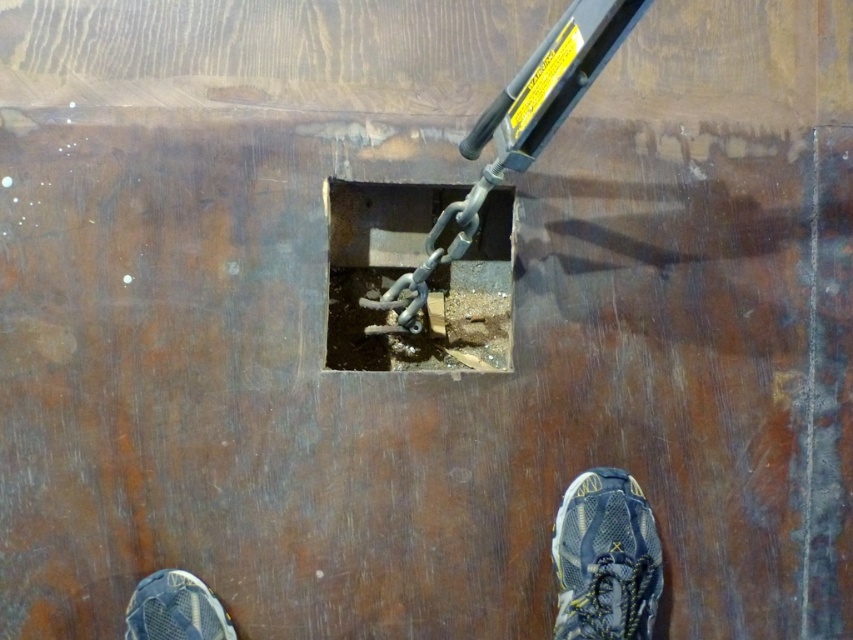
Question: Does blue mesh shoe at lower center appear under blue mesh shoe at lower left?

Choices:
 (A) yes
 (B) no

Answer: (B)

Question: Does blue mesh shoe at lower center have a smaller size compared to gray mesh shoe at lower right?

Choices:
 (A) yes
 (B) no

Answer: (A)

Question: Which object is the farthest from the gray mesh shoe at lower right?

Choices:
 (A) rusty metal hole at center
 (B) blue mesh shoe at lower left
 (C) blue mesh shoe at lower center

Answer: (B)

Question: Where is blue mesh shoe at lower center located in relation to blue mesh shoe at lower left in the image?

Choices:
 (A) left
 (B) right

Answer: (B)

Question: Which of the following is the closest to the observer?

Choices:
 (A) blue mesh shoe at lower left
 (B) blue mesh shoe at lower center
 (C) gray mesh shoe at lower right
 (D) rusty metal hole at center

Answer: (A)

Question: Which point is farther to the camera?

Choices:
 (A) blue mesh shoe at lower center
 (B) rusty metal hole at center
 (C) gray mesh shoe at lower right
 (D) blue mesh shoe at lower left

Answer: (B)